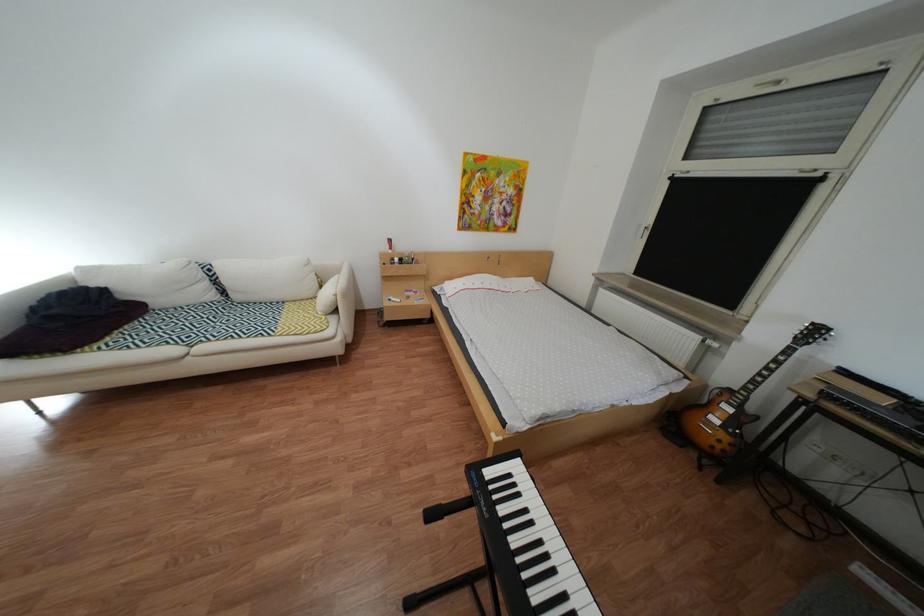
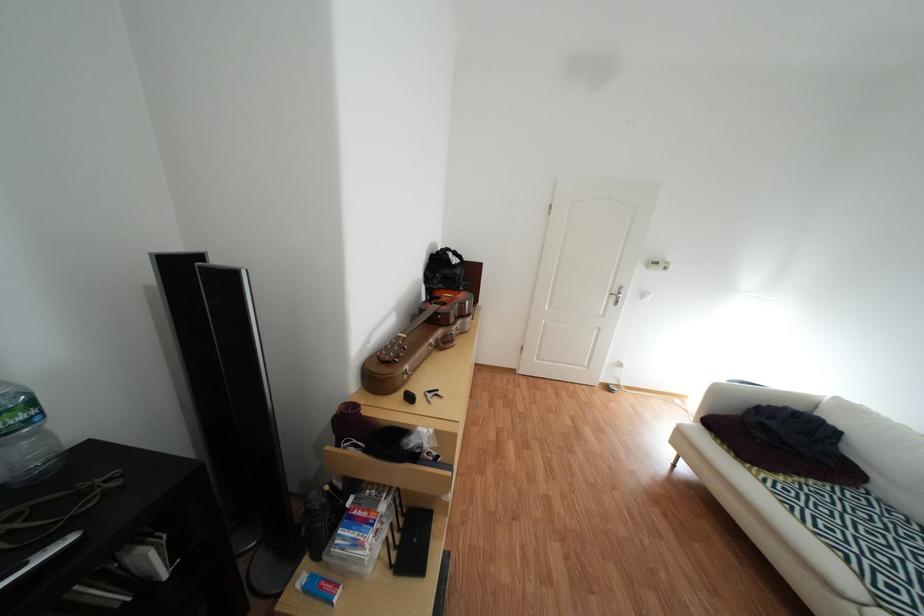
The images are taken continuously from a first-person perspective. In which direction is your viewpoint rotating?

The camera rotated toward left-down.